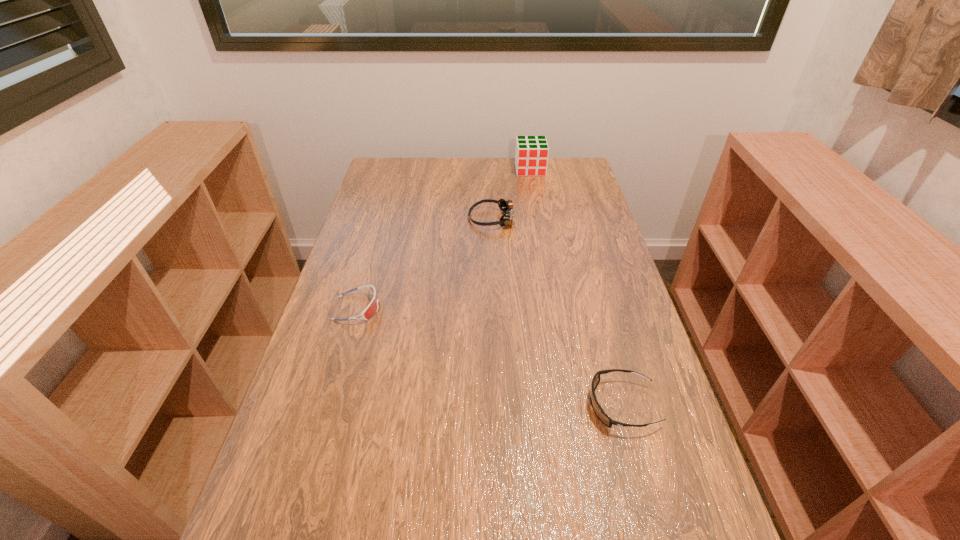
Locate an element on the screen. This screenshot has width=960, height=540. free spot between the farthest goggles and the cube is located at coordinates (512, 194).

You are a GUI agent. You are given a task and a screenshot of the screen. Output one action in this format:
    pyautogui.click(x=<x>, y=<y>)
    Task: Click on the free space between the second nearest goggles and the cube
    This screenshot has width=960, height=540.
    Given the screenshot: What is the action you would take?
    pyautogui.click(x=444, y=239)

Locate an element on the screen. the second closest object to the second goggles from left to right is located at coordinates (371, 309).

Where is `object identified as the closest to the cube`? The height and width of the screenshot is (540, 960). object identified as the closest to the cube is located at coordinates tap(506, 206).

Point out which goggles is positioned as the nearest to the nearest goggles. Please provide its 2D coordinates. Your answer should be formatted as a tuple, i.e. [(x, y)], where the tuple contains the x and y coordinates of a point satisfying the conditions above.

[(371, 309)]

Choose which goggles is the second nearest neighbor to the nearest object. Please provide its 2D coordinates. Your answer should be formatted as a tuple, i.e. [(x, y)], where the tuple contains the x and y coordinates of a point satisfying the conditions above.

[(506, 206)]

In order to click on vacant region that satisfies the following two spatial constraints: 1. on the red face of the tallest object; 2. through the lenses of the second goggles from left to right in this screenshot , I will do `click(539, 219)`.

This screenshot has width=960, height=540. I want to click on free space that satisfies the following two spatial constraints: 1. on the red face of the farthest object; 2. through the lenses of the second farthest object, so 539,219.